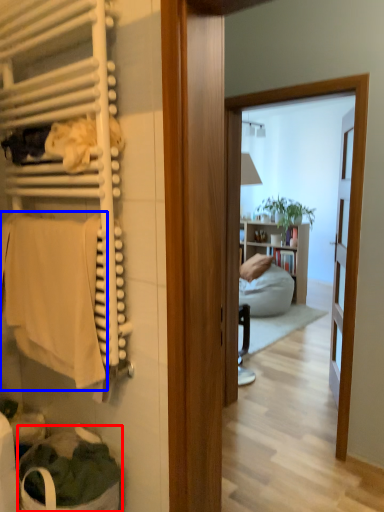
Question: Which of the following is the closest to the observer, laundry basket (highlighted by a red box) or bath towel (highlighted by a blue box)?

Choices:
 (A) laundry basket
 (B) bath towel

Answer: (B)